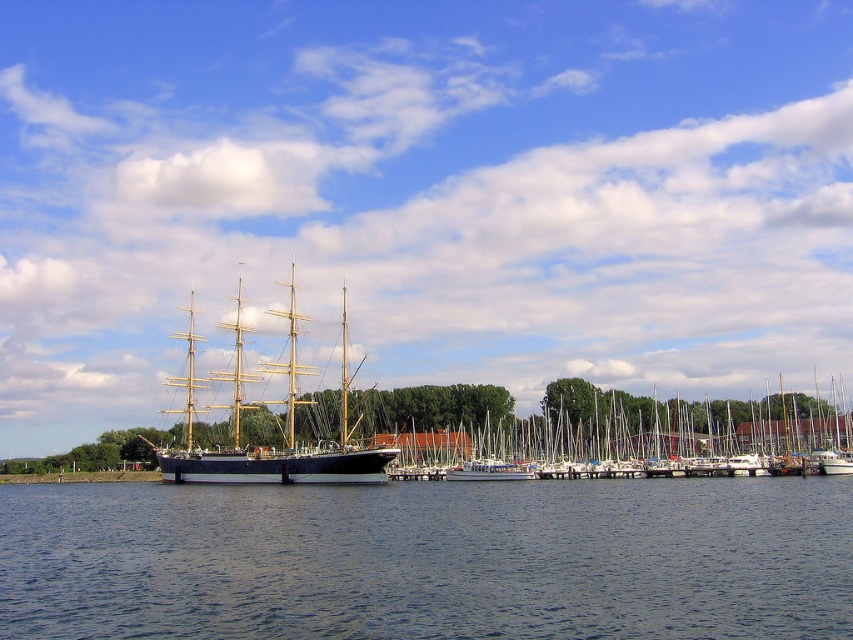
You are a harbor manager assessing the space taken up by vessels. You observe the wooden sailboat at center and the wooden ship at center. Which vessel requires more area to be anchored?

The wooden ship at center requires more area to be anchored since it occupies more space than the wooden sailboat at center.